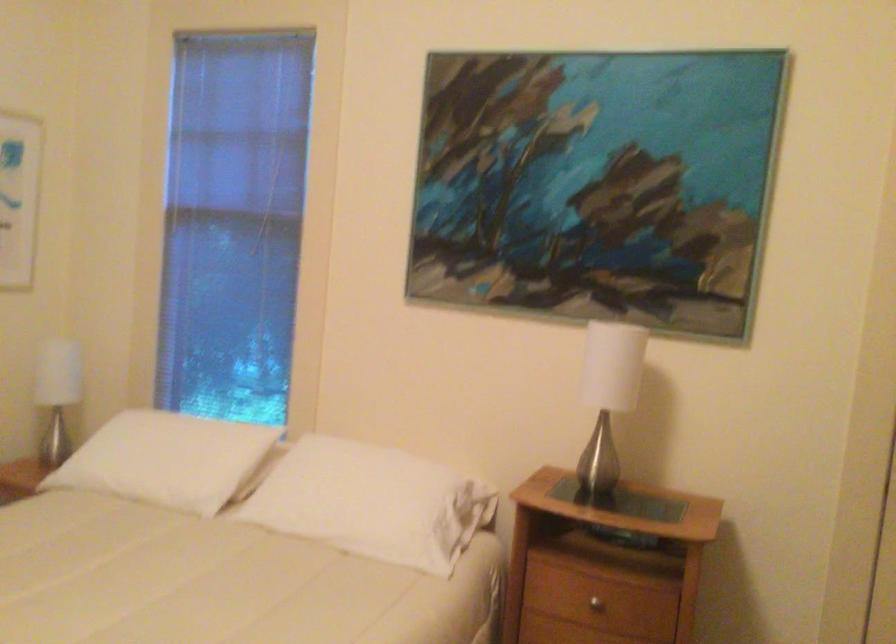
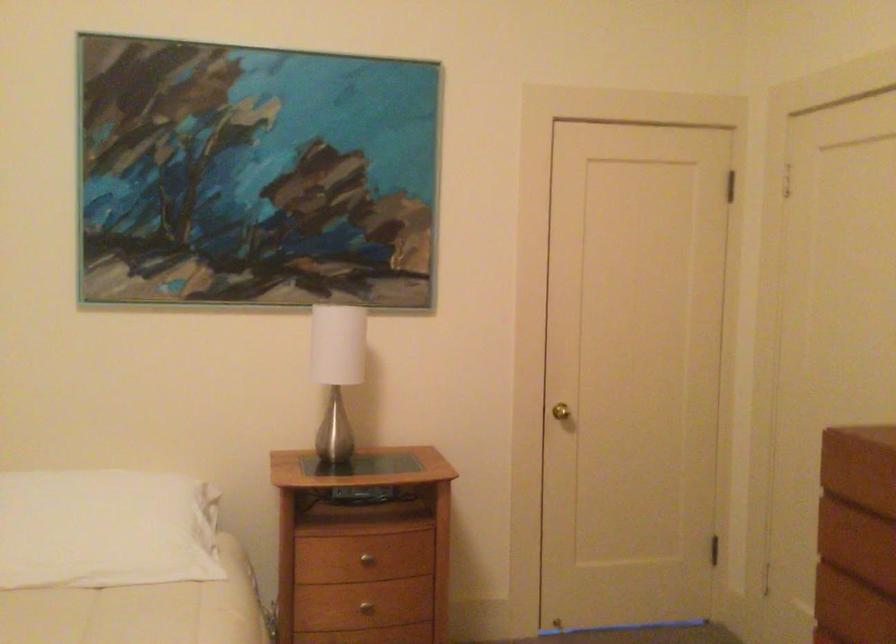
Question: The camera is either moving clockwise (left) or counter-clockwise (right) around the object. The first image is from the beginning of the video and the second image is from the end. Is the camera moving left or right when shooting the video?

Choices:
 (A) Left
 (B) Right

Answer: (A)